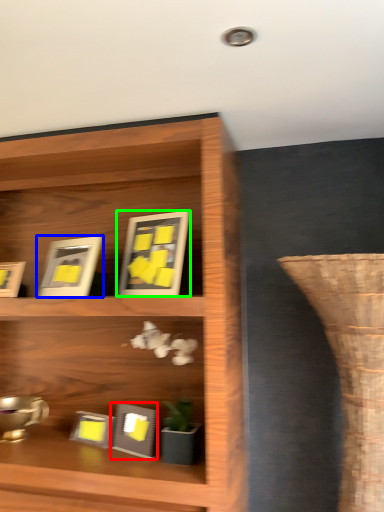
Question: Which is nearer to the picture frame (highlighted by a red box)? picture frame (highlighted by a blue box) or picture frame (highlighted by a green box).

Choices:
 (A) picture frame
 (B) picture frame

Answer: (A)